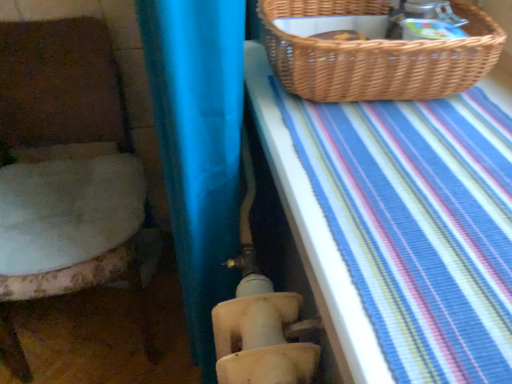
What is the approximate height of blue striped fabric at upper right?

2.18 inches.

You are a GUI agent. You are given a task and a screenshot of the screen. Output one action in this format:
    pyautogui.click(x=<x>, y=<y>)
    Task: Click on the woven brown picnic basket at upper right
    The image size is (512, 384).
    Given the screenshot: What is the action you would take?
    pyautogui.click(x=377, y=55)

Between blue striped fabric at upper right and woven brown picnic basket at upper right, which one has larger width?

Wider between the two is blue striped fabric at upper right.

Does blue striped fabric at upper right contain woven brown picnic basket at upper right?

No, woven brown picnic basket at upper right is located outside of blue striped fabric at upper right.

From the picture: Could you tell me if blue striped fabric at upper right is facing woven brown picnic basket at upper right?

No, blue striped fabric at upper right is not facing towards woven brown picnic basket at upper right.

Find the location of a particular element. The width and height of the screenshot is (512, 384). furniture that appears behind the blue striped fabric at upper right is located at coordinates (61, 85).

Considering the positions of point (100, 51) and point (331, 280), is point (100, 51) closer or farther from the camera than point (331, 280)?

Point (100, 51) is positioned farther from the camera compared to point (331, 280).

From the image's perspective, does fluffy white cushion at left appear lower than blue striped fabric at upper right?

Yes, from the image's perspective, fluffy white cushion at left is beneath blue striped fabric at upper right.

Looking at this image, is fluffy white cushion at left positioned before blue striped fabric at upper right?

No, the depth of fluffy white cushion at left is greater than that of blue striped fabric at upper right.

Is blue striped fabric at upper right taller than fluffy white cushion at left?

In fact, blue striped fabric at upper right may be shorter than fluffy white cushion at left.

Between blue striped fabric at upper right and fluffy white cushion at left, which one has larger size?

Bigger between the two is fluffy white cushion at left.

Is blue striped fabric at upper right further to camera compared to fluffy white cushion at left?

No, it is in front of fluffy white cushion at left.

Which of these two, woven brown picnic basket at upper right or blue striped fabric at upper right, is wider?

Wider between the two is blue striped fabric at upper right.

Based on the photo, based on their positions, is woven brown picnic basket at upper right located to the left or right of blue striped fabric at upper right?

woven brown picnic basket at upper right is to the left of blue striped fabric at upper right.

Is point (312, 88) positioned after point (291, 189)?

Yes, it is.

Is fluffy white cushion at left directly adjacent to woven brown picnic basket at upper right?

No, fluffy white cushion at left is not beside woven brown picnic basket at upper right.

Would you say fluffy white cushion at left is outside woven brown picnic basket at upper right?

fluffy white cushion at left lies outside woven brown picnic basket at upper right's area.

Considering the relative sizes of fluffy white cushion at left and woven brown picnic basket at upper right in the image provided, is fluffy white cushion at left thinner than woven brown picnic basket at upper right?

No, fluffy white cushion at left is not thinner than woven brown picnic basket at upper right.

From a real-world perspective, which is physically above, fluffy white cushion at left or woven brown picnic basket at upper right?

In real-world perspective, woven brown picnic basket at upper right is above.

How far apart are woven brown picnic basket at upper right and fluffy white cushion at left?

woven brown picnic basket at upper right is 76.92 centimeters from fluffy white cushion at left.

Is woven brown picnic basket at upper right turned away from fluffy white cushion at left?

No, fluffy white cushion at left is not at the back of woven brown picnic basket at upper right.

Find the location of a particular element. This screenshot has height=384, width=512. furniture on the left of the woven brown picnic basket at upper right is located at coordinates (61, 85).

Considering the sizes of objects woven brown picnic basket at upper right and fluffy white cushion at left in the image provided, who is smaller, woven brown picnic basket at upper right or fluffy white cushion at left?

woven brown picnic basket at upper right is smaller.

Locate an element on the screen. The height and width of the screenshot is (384, 512). picnic basket that is above the blue striped fabric at upper right (from a real-world perspective) is located at coordinates (377, 55).

Locate an element on the screen. sheet located in front of the fluffy white cushion at left is located at coordinates (314, 236).

Which object lies further to the anchor point blue striped fabric at upper right, fluffy white cushion at left or woven brown picnic basket at upper right?

Based on the image, fluffy white cushion at left appears to be further to blue striped fabric at upper right.

Looking at the image, which one is located closer to fluffy white cushion at left, blue striped fabric at upper right or woven brown picnic basket at upper right?

blue striped fabric at upper right.

Estimate the real-world distances between objects in this image. Which object is further from blue striped fabric at upper right, woven brown picnic basket at upper right or fluffy white cushion at left?

The object further to blue striped fabric at upper right is fluffy white cushion at left.

In the scene shown: Estimate the real-world distances between objects in this image. Which object is closer to woven brown picnic basket at upper right, fluffy white cushion at left or blue striped fabric at upper right?

The object closer to woven brown picnic basket at upper right is blue striped fabric at upper right.

Based on their spatial positions, is blue striped fabric at upper right or fluffy white cushion at left closer to woven brown picnic basket at upper right?

Based on the image, blue striped fabric at upper right appears to be nearer to woven brown picnic basket at upper right.

Looking at the image, which one is located further to fluffy white cushion at left, woven brown picnic basket at upper right or blue striped fabric at upper right?

Among the two, woven brown picnic basket at upper right is located further to fluffy white cushion at left.

Identify the location of picnic basket between fluffy white cushion at left and blue striped fabric at upper right in the horizontal direction. (377, 55).